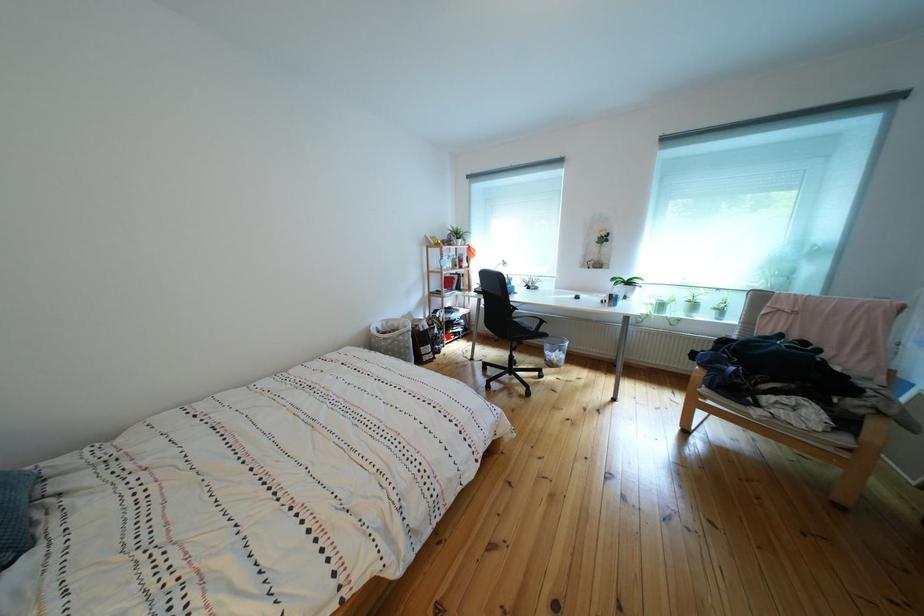
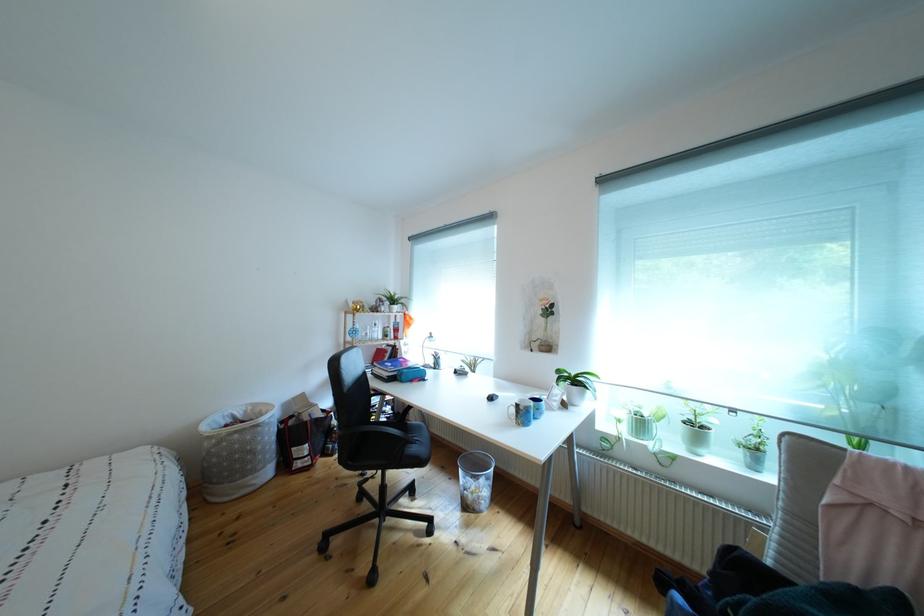
Where in the second image is the point corresponding to the highlighted location from the first image?

(346, 428)